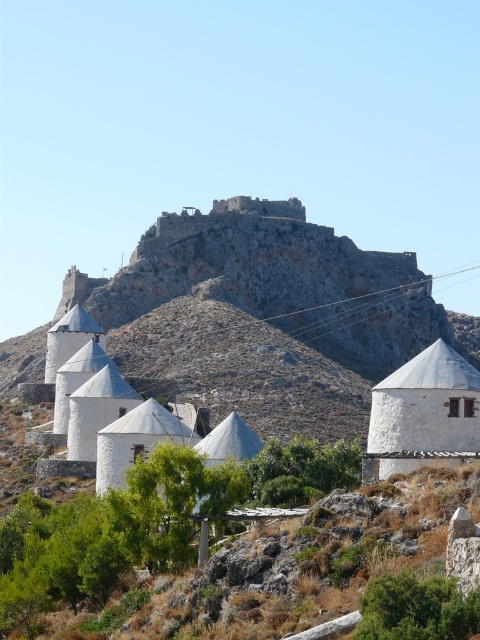
You are standing at the base of the hill where the rustic stone castle at upper center is located. If you walk straight ahead, will you be moving towards the castle or away from it?

Since the rustic stone castle at upper center is positioned at point (255, 317), walking straight ahead from the base would move you towards the castle as it is located above your current position.

You are an architect designing a new building and want to ensure it fits proportionally with the existing structures in the scene. Given the rustic stone castle at upper center and the white matte chapel at lower right, which structure should you base your design on if you want your new building to be smaller than both?

You should base your design on the white matte chapel at lower right because the rustic stone castle at upper center is wider than the white matte chapel at lower right, making the chapel a smaller reference point for the new building.

You are standing at the base of the rugged hilltop fortress and want to reach the two points marked in the image. Which point, point (x=36, y=346) or point (x=430, y=401), is closer to you?

Point (x=36, y=346) is closer to you because it is further to the viewer than point (x=430, y=401).